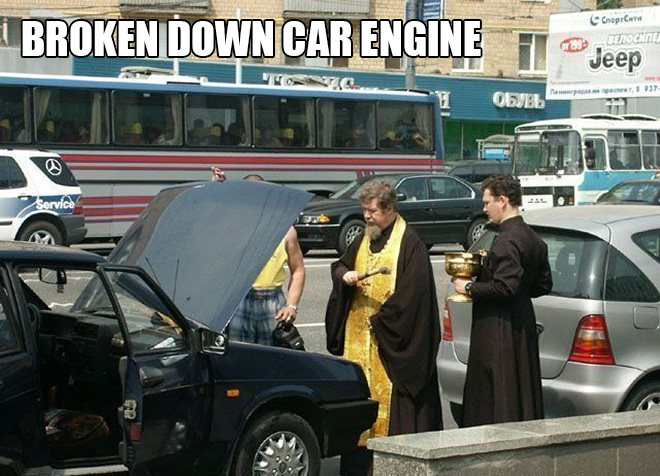
I want to click on robe, so click(x=418, y=321), click(x=502, y=312).